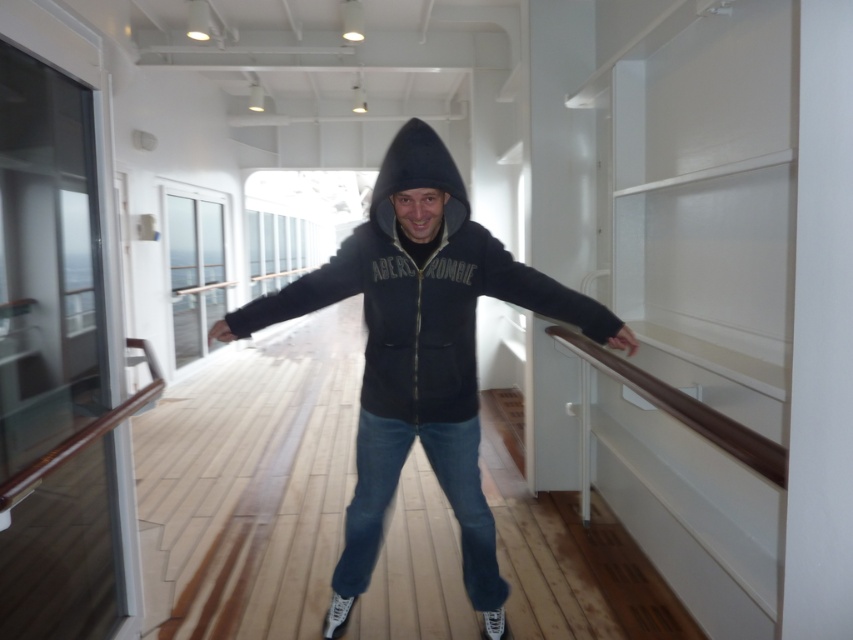
Question: Among these objects, which one is nearest to the camera?

Choices:
 (A) black fleece hoodie at center
 (B) black cotton hoodie at center

Answer: (A)

Question: Does black cotton hoodie at center appear under black fleece hoodie at center?

Choices:
 (A) yes
 (B) no

Answer: (A)

Question: Does black cotton hoodie at center lie behind black fleece hoodie at center?

Choices:
 (A) yes
 (B) no

Answer: (A)

Question: Is black cotton hoodie at center positioned behind black fleece hoodie at center?

Choices:
 (A) yes
 (B) no

Answer: (A)

Question: Which point appears farthest from the camera in this image?

Choices:
 (A) (415, 154)
 (B) (473, 406)

Answer: (B)